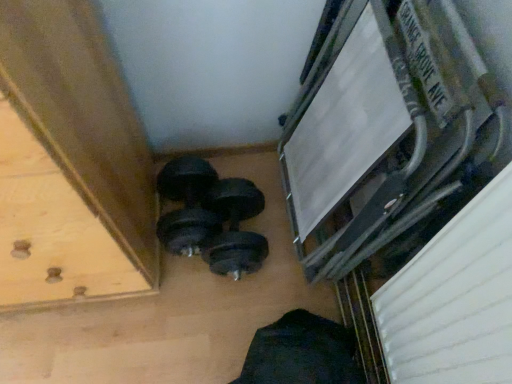
The width and height of the screenshot is (512, 384). Identify the location of black rubber dumbbell at lower center, the 2th dumbbell from the right. (186, 205).

Identify the location of wooden drawer at lower left. The width and height of the screenshot is (512, 384). [x=57, y=227].

Is wooden drawer at lower left facing towards black rubber dumbbell at center, the 1th dumbbell viewed from the right?

No, wooden drawer at lower left is not turned towards black rubber dumbbell at center, the 1th dumbbell viewed from the right.

Does wooden drawer at lower left have a smaller size compared to black rubber dumbbell at center, which is the 2th dumbbell in left-to-right order?

No, wooden drawer at lower left is not smaller than black rubber dumbbell at center, which is the 2th dumbbell in left-to-right order.

The image size is (512, 384). Find the location of `drawer above the black rubber dumbbell at center, which is the 2th dumbbell in left-to-right order (from the image's perspective)`. drawer above the black rubber dumbbell at center, which is the 2th dumbbell in left-to-right order (from the image's perspective) is located at coordinates (57, 227).

Which object is more forward, wooden drawer at lower left or black rubber dumbbell at center, the 1th dumbbell viewed from the right?

Positioned in front is wooden drawer at lower left.

Considering the sizes of objects black rubber dumbbell at center, which is the 2th dumbbell in left-to-right order, and metallic silver frame at upper right in the image provided, who is taller, black rubber dumbbell at center, which is the 2th dumbbell in left-to-right order, or metallic silver frame at upper right?

Standing taller between the two is metallic silver frame at upper right.

Is black rubber dumbbell at center, which is the 2th dumbbell in left-to-right order, bigger than metallic silver frame at upper right?

Incorrect, black rubber dumbbell at center, which is the 2th dumbbell in left-to-right order, is not larger than metallic silver frame at upper right.

Considering the positions of objects black rubber dumbbell at center, the 1th dumbbell viewed from the right, and metallic silver frame at upper right in the image provided, who is more to the right, black rubber dumbbell at center, the 1th dumbbell viewed from the right, or metallic silver frame at upper right?

Positioned to the right is metallic silver frame at upper right.

From a real-world perspective, is black rubber dumbbell at center, the 1th dumbbell viewed from the right, above or below metallic silver frame at upper right?

From a real-world perspective, black rubber dumbbell at center, the 1th dumbbell viewed from the right, is physically below metallic silver frame at upper right.

Is black rubber dumbbell at lower center, which is counted as the first dumbbell, starting from the left, completely or partially inside black rubber dumbbell at center, which is the 2th dumbbell in left-to-right order?

Indeed, black rubber dumbbell at lower center, which is counted as the first dumbbell, starting from the left, is located within black rubber dumbbell at center, which is the 2th dumbbell in left-to-right order.

From the image's perspective, which is above, black rubber dumbbell at center, the 1th dumbbell viewed from the right, or black rubber dumbbell at lower center, which is counted as the first dumbbell, starting from the left?

black rubber dumbbell at lower center, which is counted as the first dumbbell, starting from the left.

This screenshot has width=512, height=384. Identify the location of dumbbell below the black rubber dumbbell at lower center, the 2th dumbbell from the right (from the image's perspective). (234, 228).

Which of these two, black rubber dumbbell at center, which is the 2th dumbbell in left-to-right order, or black rubber dumbbell at lower center, which is counted as the first dumbbell, starting from the left, is bigger?

Bigger between the two is black rubber dumbbell at center, which is the 2th dumbbell in left-to-right order.

Is black rubber dumbbell at lower center, which is counted as the first dumbbell, starting from the left, aimed at wooden drawer at lower left?

No, black rubber dumbbell at lower center, which is counted as the first dumbbell, starting from the left, is not aimed at wooden drawer at lower left.

Is point (179, 235) positioned behind point (133, 274)?

That is True.

Can you confirm if black rubber dumbbell at lower center, the 2th dumbbell from the right, is shorter than wooden drawer at lower left?

Correct, black rubber dumbbell at lower center, the 2th dumbbell from the right, is not as tall as wooden drawer at lower left.

Identify the location of drawer that appears above the black rubber dumbbell at lower center, which is counted as the first dumbbell, starting from the left (from a real-world perspective). (57, 227).

From the image's perspective, is black rubber dumbbell at lower center, which is counted as the first dumbbell, starting from the left, under black rubber dumbbell at center, the 1th dumbbell viewed from the right?

No.

Which of these two, black rubber dumbbell at lower center, which is counted as the first dumbbell, starting from the left, or black rubber dumbbell at center, which is the 2th dumbbell in left-to-right order, is bigger?

black rubber dumbbell at center, which is the 2th dumbbell in left-to-right order.

From a real-world perspective, which is physically above, black rubber dumbbell at lower center, which is counted as the first dumbbell, starting from the left, or black rubber dumbbell at center, which is the 2th dumbbell in left-to-right order?

black rubber dumbbell at lower center, which is counted as the first dumbbell, starting from the left, from a real-world perspective.

Visually, is black rubber dumbbell at lower center, which is counted as the first dumbbell, starting from the left, positioned to the left or to the right of black rubber dumbbell at center, the 1th dumbbell viewed from the right?

Clearly, black rubber dumbbell at lower center, which is counted as the first dumbbell, starting from the left, is on the left of black rubber dumbbell at center, the 1th dumbbell viewed from the right, in the image.

Is metallic silver frame at upper right positioned before black rubber dumbbell at center, which is the 2th dumbbell in left-to-right order?

Yes, metallic silver frame at upper right is closer to the viewer.

Where is `the 2nd dumbbell below the metallic silver frame at upper right (from the image's perspective)`? The image size is (512, 384). the 2nd dumbbell below the metallic silver frame at upper right (from the image's perspective) is located at coordinates (234, 228).

From a real-world perspective, is metallic silver frame at upper right located beneath black rubber dumbbell at center, which is the 2th dumbbell in left-to-right order?

Actually, metallic silver frame at upper right is physically above black rubber dumbbell at center, which is the 2th dumbbell in left-to-right order, in the real world.

Based on the photo, which of these two, metallic silver frame at upper right or black rubber dumbbell at center, which is the 2th dumbbell in left-to-right order, stands shorter?

black rubber dumbbell at center, which is the 2th dumbbell in left-to-right order.

From a real-world perspective, who is located higher, black rubber dumbbell at lower center, the 2th dumbbell from the right, or metallic silver frame at upper right?

→ metallic silver frame at upper right.

Is black rubber dumbbell at lower center, the 2th dumbbell from the right, oriented away from metallic silver frame at upper right?

No, metallic silver frame at upper right is not at the back of black rubber dumbbell at lower center, the 2th dumbbell from the right.

Is black rubber dumbbell at lower center, which is counted as the first dumbbell, starting from the left, not within metallic silver frame at upper right?

black rubber dumbbell at lower center, which is counted as the first dumbbell, starting from the left, lies outside metallic silver frame at upper right's area.

Where is `dumbbell that is the 2nd one when counting downward from the wooden drawer at lower left (from the image's perspective)`? This screenshot has height=384, width=512. dumbbell that is the 2nd one when counting downward from the wooden drawer at lower left (from the image's perspective) is located at coordinates (234, 228).

Where is `window frame above the black rubber dumbbell at center, which is the 2th dumbbell in left-to-right order (from the image's perspective)`? This screenshot has width=512, height=384. window frame above the black rubber dumbbell at center, which is the 2th dumbbell in left-to-right order (from the image's perspective) is located at coordinates (346, 115).

From the image, which object appears to be farther from black rubber dumbbell at lower center, which is counted as the first dumbbell, starting from the left, metallic silver frame at upper right or black rubber dumbbell at center, which is the 2th dumbbell in left-to-right order?

metallic silver frame at upper right lies further to black rubber dumbbell at lower center, which is counted as the first dumbbell, starting from the left, than the other object.

Which object lies further to the anchor point black rubber dumbbell at lower center, which is counted as the first dumbbell, starting from the left, metallic silver frame at upper right or wooden drawer at lower left?

metallic silver frame at upper right is positioned further to the anchor black rubber dumbbell at lower center, which is counted as the first dumbbell, starting from the left.

Estimate the real-world distances between objects in this image. Which object is closer to metallic silver frame at upper right, black rubber dumbbell at lower center, which is counted as the first dumbbell, starting from the left, or black rubber dumbbell at center, the 1th dumbbell viewed from the right?

black rubber dumbbell at center, the 1th dumbbell viewed from the right, is positioned closer to the anchor metallic silver frame at upper right.

Considering their positions, is metallic silver frame at upper right positioned closer to wooden drawer at lower left than black rubber dumbbell at center, which is the 2th dumbbell in left-to-right order?

Based on the image, black rubber dumbbell at center, which is the 2th dumbbell in left-to-right order, appears to be nearer to wooden drawer at lower left.

Based on their spatial positions, is metallic silver frame at upper right or wooden drawer at lower left closer to black rubber dumbbell at center, which is the 2th dumbbell in left-to-right order?

The object closer to black rubber dumbbell at center, which is the 2th dumbbell in left-to-right order, is metallic silver frame at upper right.

When comparing their distances from metallic silver frame at upper right, does black rubber dumbbell at center, which is the 2th dumbbell in left-to-right order, or wooden drawer at lower left seem further?

Among the two, wooden drawer at lower left is located further to metallic silver frame at upper right.

Looking at this image, considering their positions, is metallic silver frame at upper right positioned further to wooden drawer at lower left than black rubber dumbbell at lower center, the 2th dumbbell from the right?

The object further to wooden drawer at lower left is metallic silver frame at upper right.

From the image, which object appears to be nearer to black rubber dumbbell at lower center, the 2th dumbbell from the right, wooden drawer at lower left or black rubber dumbbell at center, which is the 2th dumbbell in left-to-right order?

Based on the image, black rubber dumbbell at center, which is the 2th dumbbell in left-to-right order, appears to be nearer to black rubber dumbbell at lower center, the 2th dumbbell from the right.

Find the location of a particular element. dumbbell between metallic silver frame at upper right and black rubber dumbbell at lower center, the 2th dumbbell from the right, along the z-axis is located at coordinates (234, 228).

You are a GUI agent. You are given a task and a screenshot of the screen. Output one action in this format:
    pyautogui.click(x=<x>, y=<y>)
    Task: Click on the window frame between wooden drawer at lower left and black rubber dumbbell at lower center, which is counted as the first dumbbell, starting from the left, from front to back
    This screenshot has width=512, height=384.
    Given the screenshot: What is the action you would take?
    pyautogui.click(x=346, y=115)

Where is `dumbbell between wooden drawer at lower left and black rubber dumbbell at lower center, which is counted as the first dumbbell, starting from the left, along the z-axis`? This screenshot has width=512, height=384. dumbbell between wooden drawer at lower left and black rubber dumbbell at lower center, which is counted as the first dumbbell, starting from the left, along the z-axis is located at coordinates (234, 228).